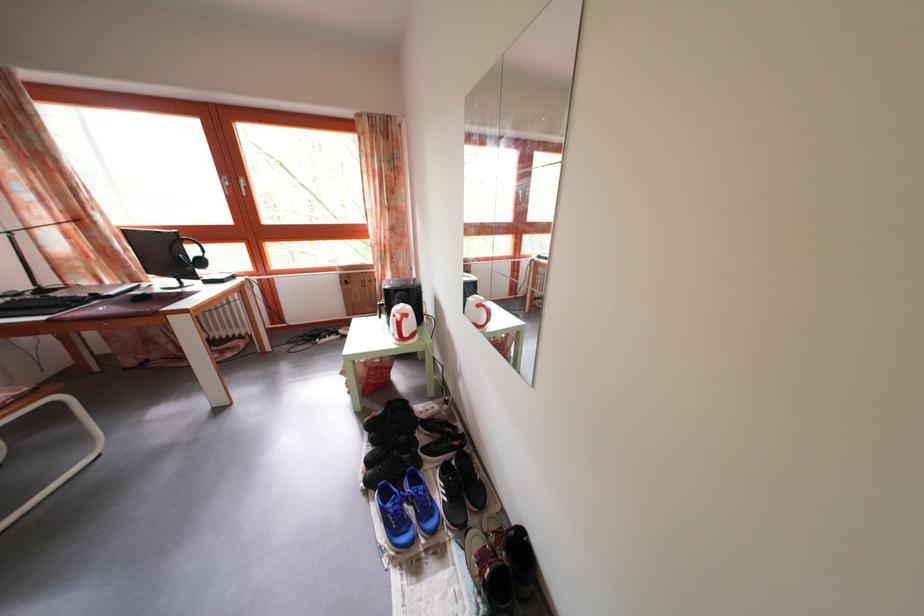
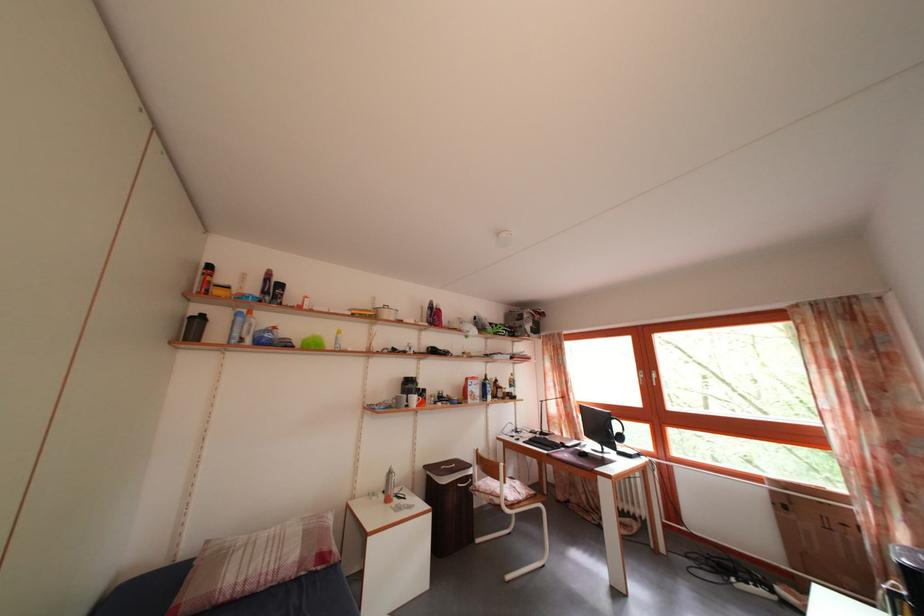
In the second image, find the point that corresponds to (50,299) in the first image.

(550, 440)